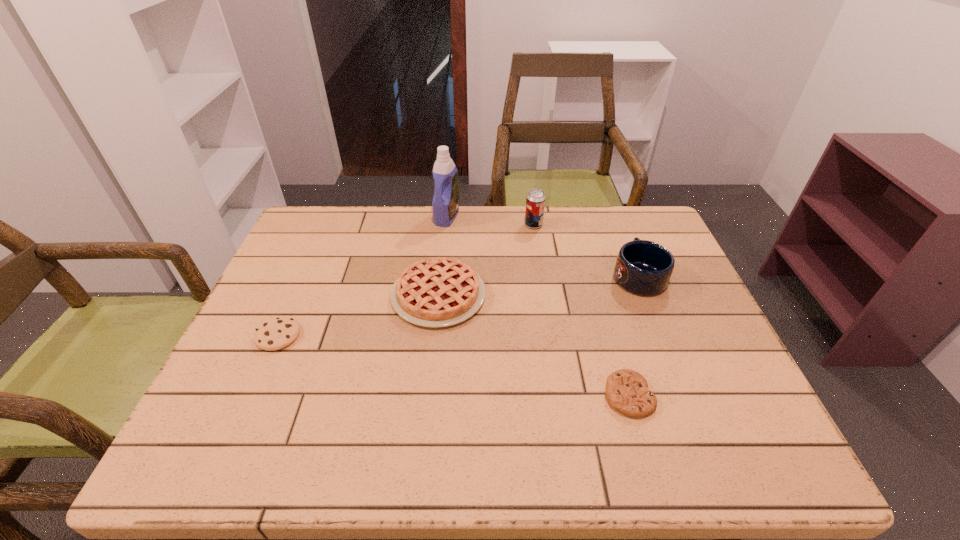
Locate an element on the screen. Image resolution: width=960 pixels, height=540 pixels. detergent is located at coordinates (445, 203).

Where is `the second tallest object`? the second tallest object is located at coordinates (535, 202).

Where is `beer can`? This screenshot has width=960, height=540. beer can is located at coordinates (535, 202).

Identify the location of the third tallest object. The height and width of the screenshot is (540, 960). (643, 267).

Find the location of `pie`. pie is located at coordinates (437, 292).

I want to click on the farther cookie, so click(x=276, y=333).

I want to click on the left cookie, so click(x=276, y=333).

In order to click on the nearest object in this screenshot , I will do `click(627, 391)`.

The width and height of the screenshot is (960, 540). Identify the location of the right cookie. pos(627,391).

Find the location of a particular element. The height and width of the screenshot is (540, 960). blank space located 0.210m on the right of the tallest object is located at coordinates (524, 217).